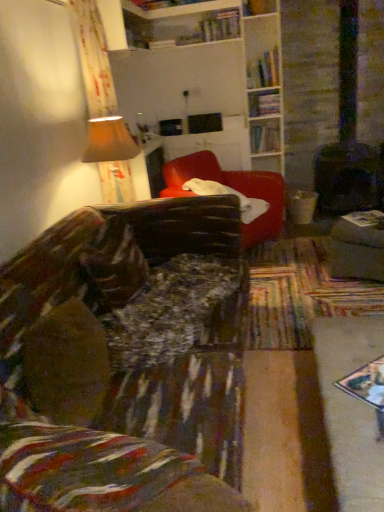
Question: Is hardcover book at upper center, which is the 2th book in bottom-to-top order, inside the boundaries of wooden bookshelf at upper center, acting as the 2th shelf starting from the back, or outside?

Choices:
 (A) outside
 (B) inside

Answer: (A)

Question: Is point (274, 130) positioned closer to the camera than point (246, 5)?

Choices:
 (A) farther
 (B) closer

Answer: (A)

Question: Which is farther from the matte beige lampshade at upper left?

Choices:
 (A) wooden bookshelf at upper center, acting as the 2th shelf starting from the back
 (B) white paper book at right, the 4th book positioned from the back
 (C) velvet-like brown couch at lower left, the 2th studio couch positioned from the top
 (D) velvet-like red couch at center, the second studio couch positioned from the bottom
 (E) matte gray ottoman at right

Answer: (A)

Question: Which is farther from the matte gray ottoman at right?

Choices:
 (A) matte beige lampshade at upper left
 (B) wooden bookshelf at upper center, which ranks as the second shelf in top-to-bottom order
 (C) hardcover books at upper right, the second book when ordered from left to right
 (D) wooden bookshelf at upper center, arranged as the first shelf when viewed from the top
 (E) velvet-like red couch at center, which is counted as the 1th studio couch, starting from the back

Answer: (D)